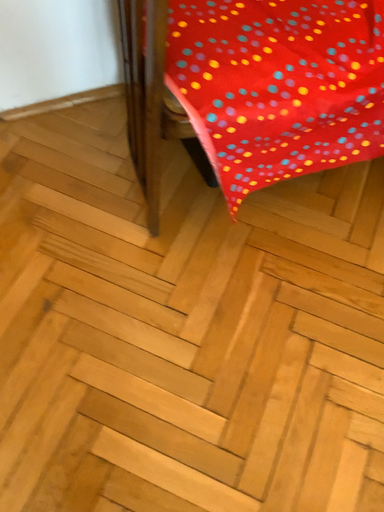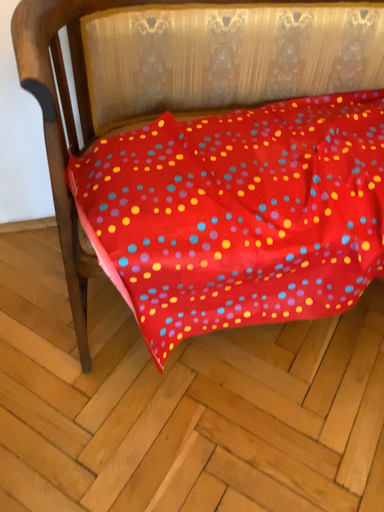
Question: Which way did the camera rotate in the video?

Choices:
 (A) rotated downward
 (B) rotated upward

Answer: (B)